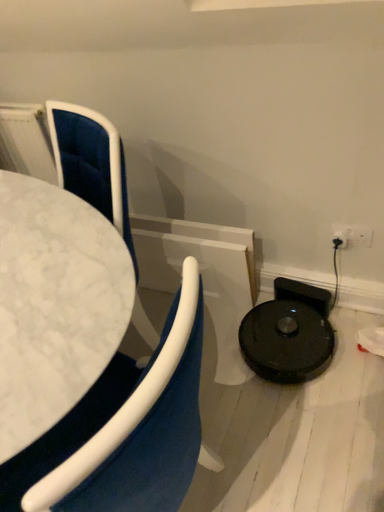
Question: Could you tell me if velvet blue chair at left, positioned as the first chair in right-to-left order, is facing velvet blue chair at left, acting as the 2th chair starting from the right?

Choices:
 (A) no
 (B) yes

Answer: (B)

Question: From a real-world perspective, is velvet blue chair at left, positioned as the first chair in right-to-left order, positioned over velvet blue chair at left, acting as the 2th chair starting from the right, based on gravity?

Choices:
 (A) yes
 (B) no

Answer: (A)

Question: Is velvet blue chair at left, positioned as the first chair in right-to-left order, directly adjacent to velvet blue chair at left, acting as the 2th chair starting from the right?

Choices:
 (A) no
 (B) yes

Answer: (A)

Question: Can you confirm if velvet blue chair at left, which ranks as the 2th chair in left-to-right order, is wider than velvet blue chair at left, acting as the 2th chair starting from the right?

Choices:
 (A) no
 (B) yes

Answer: (A)

Question: Is velvet blue chair at left, positioned as the first chair in right-to-left order, at the left side of velvet blue chair at left, acting as the 2th chair starting from the right?

Choices:
 (A) no
 (B) yes

Answer: (A)

Question: Considering the relative sizes of velvet blue chair at left, which ranks as the 2th chair in left-to-right order, and velvet blue chair at left, positioned as the first chair in left-to-right order, in the image provided, is velvet blue chair at left, which ranks as the 2th chair in left-to-right order, taller than velvet blue chair at left, positioned as the first chair in left-to-right order,?

Choices:
 (A) no
 (B) yes

Answer: (A)

Question: Is velvet blue chair at left, positioned as the first chair in left-to-right order, thinner than velvet blue chair at left, positioned as the first chair in right-to-left order?

Choices:
 (A) yes
 (B) no

Answer: (B)

Question: Could you tell me if velvet blue chair at left, positioned as the first chair in left-to-right order, is facing velvet blue chair at left, positioned as the first chair in right-to-left order?

Choices:
 (A) no
 (B) yes

Answer: (B)

Question: Would you say velvet blue chair at left, acting as the 2th chair starting from the right, is outside velvet blue chair at left, which ranks as the 2th chair in left-to-right order?

Choices:
 (A) no
 (B) yes

Answer: (B)

Question: Is velvet blue chair at left, acting as the 2th chair starting from the right, to the right of velvet blue chair at left, which ranks as the 2th chair in left-to-right order, from the viewer's perspective?

Choices:
 (A) no
 (B) yes

Answer: (A)

Question: From a real-world perspective, is velvet blue chair at left, acting as the 2th chair starting from the right, on top of velvet blue chair at left, positioned as the first chair in right-to-left order?

Choices:
 (A) yes
 (B) no

Answer: (B)

Question: Does velvet blue chair at left, positioned as the first chair in left-to-right order, appear on the left side of velvet blue chair at left, which ranks as the 2th chair in left-to-right order?

Choices:
 (A) yes
 (B) no

Answer: (A)

Question: Is velvet blue chair at left, which ranks as the 2th chair in left-to-right order, taller or shorter than velvet blue chair at left, positioned as the first chair in left-to-right order?

Choices:
 (A) short
 (B) tall

Answer: (A)